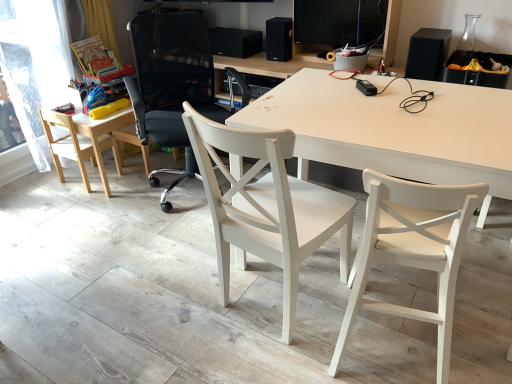
You are a GUI agent. You are given a task and a screenshot of the screen. Output one action in this format:
    pyautogui.click(x=<x>, y=<y>)
    Task: Click on the free area in between light wood chair at left, arranged as the 1th chair when viewed from the left, and transparent plastic window screen at left
    
    Given the screenshot: What is the action you would take?
    pyautogui.click(x=66, y=185)